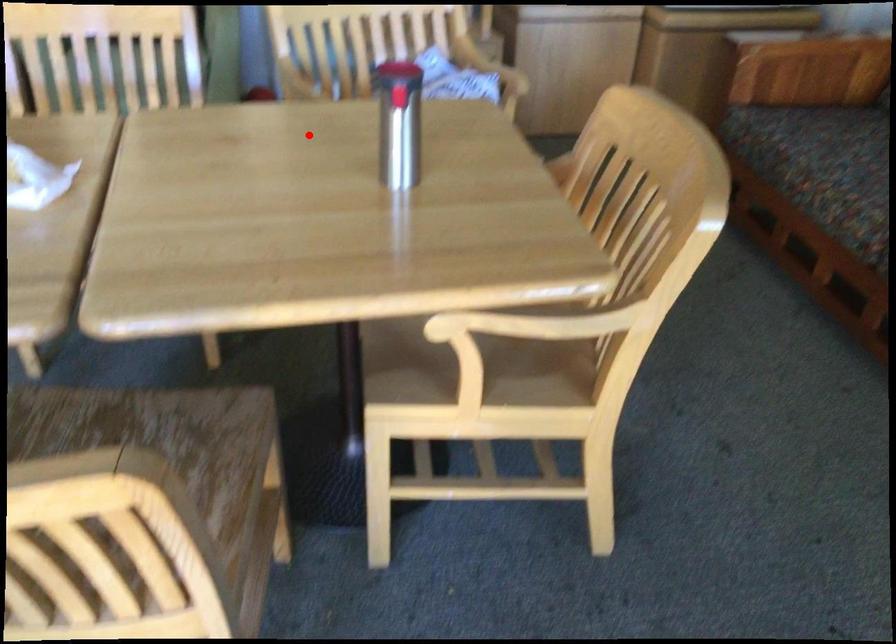
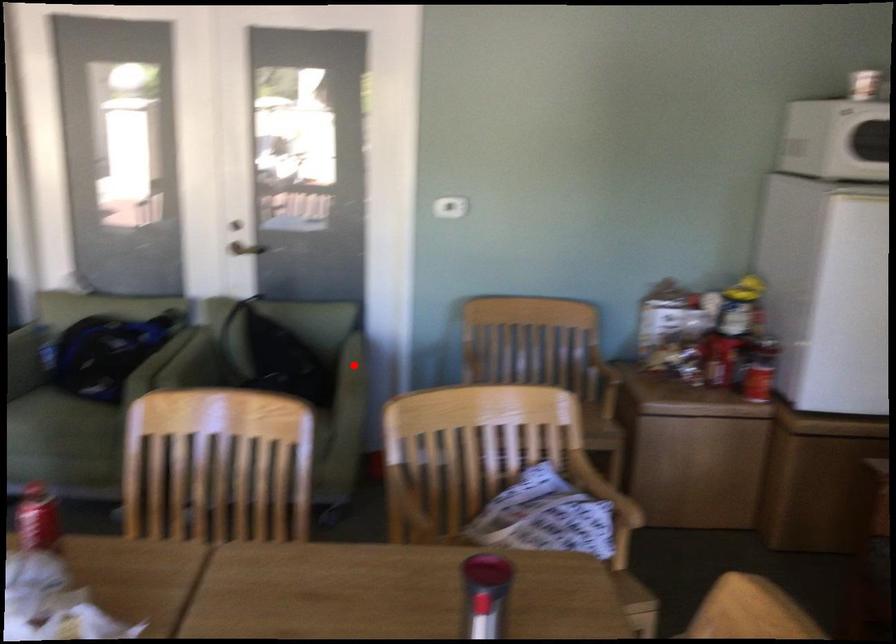
I am providing you with two images of the same scene from different viewpoints. A red point is marked on the first image and another point is marked on the second image. Is the red point in image1 aligned with the point shown in image2?

No